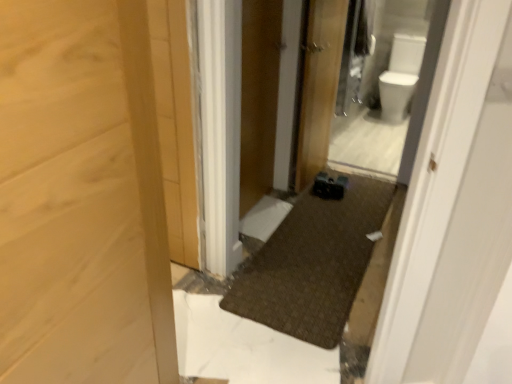
You are a GUI agent. You are given a task and a screenshot of the screen. Output one action in this format:
    pyautogui.click(x=<x>, y=<y>)
    Task: Click on the wooden screen door at center
    The width and height of the screenshot is (512, 384).
    Given the screenshot: What is the action you would take?
    pyautogui.click(x=259, y=97)

Which is closer, [273,30] or [397,123]?

Point [273,30] is positioned closer to the camera compared to point [397,123].

Is wooden screen door at center facing away from white glossy toilet bowl at upper right?

wooden screen door at center does not have its back to white glossy toilet bowl at upper right.

Considering the relative positions of wooden screen door at center and white glossy toilet bowl at upper right in the image provided, is wooden screen door at center in front of white glossy toilet bowl at upper right?

Yes.

In the scene shown: Is white glossy toilet bowl at upper right turned away from wooden screen door at center?

No, white glossy toilet bowl at upper right is not facing away from wooden screen door at center.

From a real-world perspective, is white glossy toilet bowl at upper right positioned over wooden screen door at center based on gravity?

No, from a real-world perspective, white glossy toilet bowl at upper right is not over wooden screen door at center

Consider the image. Can you see white glossy toilet bowl at upper right touching wooden screen door at center?

They are not placed beside each other.

Find the location of a particular element. This screenshot has height=384, width=512. door that appears on the left of white glossy toilet bowl at upper right is located at coordinates (318, 86).

Relative to white glossy toilet bowl at upper right, is wooden door at center in front or behind?

wooden door at center is in front of white glossy toilet bowl at upper right.

Can you confirm if wooden door at center is bigger than white glossy toilet bowl at upper right?

Incorrect, wooden door at center is not larger than white glossy toilet bowl at upper right.

Are wooden screen door at center and wooden door at center beside each other?

They are not placed beside each other.

Can wooden door at center be found inside wooden screen door at center?

That's incorrect, wooden door at center is not inside wooden screen door at center.

From a real-world perspective, is wooden screen door at center positioned over wooden door at center based on gravity?

Yes, from a real-world perspective, wooden screen door at center is over wooden door at center

Can you tell me how much wooden screen door at center and wooden door at center differ in facing direction?

The angle between the facing direction of wooden screen door at center and the facing direction of wooden door at center is 1.78 degrees.

The image size is (512, 384). What are the coordinates of `door behind the wooden screen door at center` in the screenshot? It's located at (318, 86).

Which object is thinner, wooden door at center or wooden screen door at center?

wooden screen door at center.

Does point (327, 89) come in front of point (248, 137)?

No, (327, 89) is further to viewer.

Is wooden door at center taller or shorter than wooden screen door at center?

In the image, wooden door at center appears to be shorter than wooden screen door at center.

In the scene shown: Is white glossy toilet bowl at upper right to the left of wooden door at center from the viewer's perspective?

No, white glossy toilet bowl at upper right is not to the left of wooden door at center.

Does white glossy toilet bowl at upper right have a larger size compared to wooden door at center?

Yes.

Is white glossy toilet bowl at upper right next to wooden door at center and touching it?

white glossy toilet bowl at upper right and wooden door at center are clearly separated.

Looking at this image, from the image's perspective, is white glossy toilet bowl at upper right above or below wooden door at center?

white glossy toilet bowl at upper right is above wooden door at center.

The height and width of the screenshot is (384, 512). What are the coordinates of `screen door on the left of the white glossy toilet bowl at upper right` in the screenshot? It's located at (259, 97).

Find the location of a particular element. Image resolution: width=512 pixels, height=384 pixels. toilet bowl that appears above the wooden screen door at center (from the image's perspective) is located at coordinates (400, 77).

Which object lies further to the anchor point wooden screen door at center, wooden door at center or white glossy toilet bowl at upper right?

white glossy toilet bowl at upper right is further to wooden screen door at center.

From the image, which object appears to be farther from white glossy toilet bowl at upper right, wooden screen door at center or wooden door at center?

wooden screen door at center is further to white glossy toilet bowl at upper right.

Looking at the image, which one is located further to wooden door at center, white glossy toilet bowl at upper right or wooden screen door at center?

Based on the image, white glossy toilet bowl at upper right appears to be further to wooden door at center.

Looking at the image, which one is located closer to white glossy toilet bowl at upper right, wooden door at center or wooden screen door at center?

wooden door at center is closer to white glossy toilet bowl at upper right.

When comparing their distances from wooden screen door at center, does white glossy toilet bowl at upper right or wooden door at center seem further?

white glossy toilet bowl at upper right.

From the image, which object appears to be nearer to wooden door at center, wooden screen door at center or white glossy toilet bowl at upper right?

wooden screen door at center lies closer to wooden door at center than the other object.

The image size is (512, 384). I want to click on door between wooden screen door at center and white glossy toilet bowl at upper right in the front-back direction, so click(x=318, y=86).